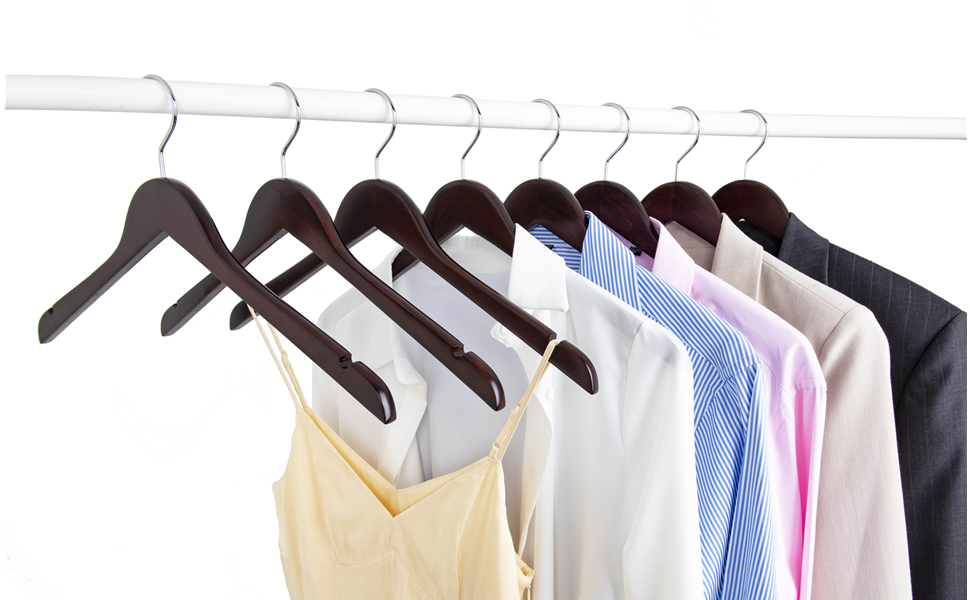
Where is `clothes hangers`? The image size is (970, 600). clothes hangers is located at coordinates (182, 216), (285, 217), (364, 213), (459, 209), (540, 208), (616, 204), (690, 202), (768, 200).